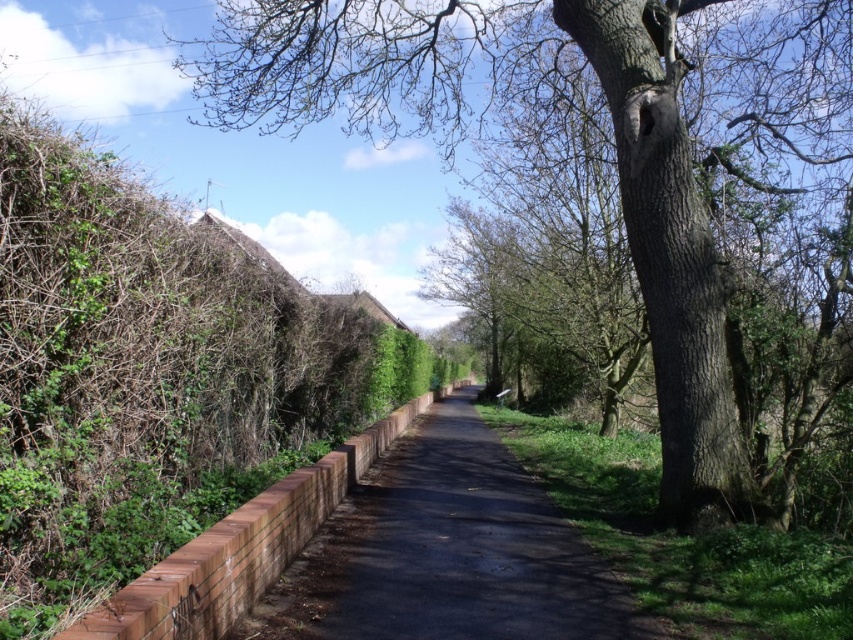
Question: Is brown rough bark tree at upper right above green leafy hedge at left?

Choices:
 (A) no
 (B) yes

Answer: (B)

Question: Among these objects, which one is nearest to the camera?

Choices:
 (A) brown rough bark tree at upper right
 (B) brick wall at center

Answer: (B)

Question: Can you confirm if green leafy hedge at left is thinner than brick wall at center?

Choices:
 (A) no
 (B) yes

Answer: (A)

Question: Which of the following is the closest to the observer?

Choices:
 (A) brown rough bark tree at upper right
 (B) green leafy hedge at left

Answer: (B)

Question: Observing the image, what is the correct spatial positioning of brown rough bark tree at upper right in reference to green leafy hedge at left?

Choices:
 (A) left
 (B) right

Answer: (B)

Question: Estimate the real-world distances between objects in this image. Which object is closer to the brown rough bark tree at upper right?

Choices:
 (A) brick wall at center
 (B) green leafy hedge at left

Answer: (B)